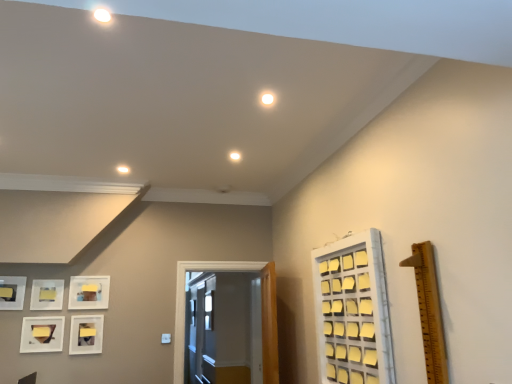
Question: Is wooden ruler at right positioned behind white glossy door at center?

Choices:
 (A) no
 (B) yes

Answer: (A)

Question: Would you say white glossy door at center is part of wooden ruler at right's contents?

Choices:
 (A) no
 (B) yes

Answer: (A)

Question: Considering the relative sizes of wooden ruler at right and white glossy door at center in the image provided, is wooden ruler at right taller than white glossy door at center?

Choices:
 (A) yes
 (B) no

Answer: (B)

Question: From the image's perspective, is wooden ruler at right below white glossy door at center?

Choices:
 (A) no
 (B) yes

Answer: (A)

Question: Is wooden ruler at right outside white glossy door at center?

Choices:
 (A) no
 (B) yes

Answer: (B)

Question: Visually, is matte white picture frame at lower left, acting as the third picture frame starting from the right, positioned to the left or to the right of wooden ruler at right?

Choices:
 (A) left
 (B) right

Answer: (A)

Question: Is matte white picture frame at lower left, acting as the third picture frame starting from the right, inside or outside of wooden ruler at right?

Choices:
 (A) inside
 (B) outside

Answer: (B)

Question: Relative to wooden ruler at right, is matte white picture frame at lower left, the 3th picture frame from the left, in front or behind?

Choices:
 (A) behind
 (B) front

Answer: (A)

Question: From a real-world perspective, relative to wooden ruler at right, is matte white picture frame at lower left, the 3th picture frame from the left, vertically above or below?

Choices:
 (A) below
 (B) above

Answer: (A)

Question: From the image's perspective, is wooden ruler at right above or below matte white picture frame at lower left, which is counted as the 1th picture frame, starting from the right?

Choices:
 (A) below
 (B) above

Answer: (B)

Question: From a real-world perspective, is wooden ruler at right above or below matte white picture frame at lower left, which is counted as the 1th picture frame, starting from the right?

Choices:
 (A) below
 (B) above

Answer: (B)

Question: Is wooden ruler at right inside or outside of matte white picture frame at lower left, which is counted as the 1th picture frame, starting from the right?

Choices:
 (A) inside
 (B) outside

Answer: (B)

Question: Considering the positions of wooden ruler at right and matte white picture frame at lower left, arranged as the 5th picture frame when viewed from the left, in the image, is wooden ruler at right bigger or smaller than matte white picture frame at lower left, arranged as the 5th picture frame when viewed from the left,?

Choices:
 (A) big
 (B) small

Answer: (A)

Question: In the image, is matte white picture frame at lower left, arranged as the 5th picture frame when viewed from the left, positioned in front of or behind wooden ruler at right?

Choices:
 (A) front
 (B) behind

Answer: (B)

Question: Does point click(x=95, y=319) appear closer or farther from the camera than point click(x=437, y=354)?

Choices:
 (A) farther
 (B) closer

Answer: (A)